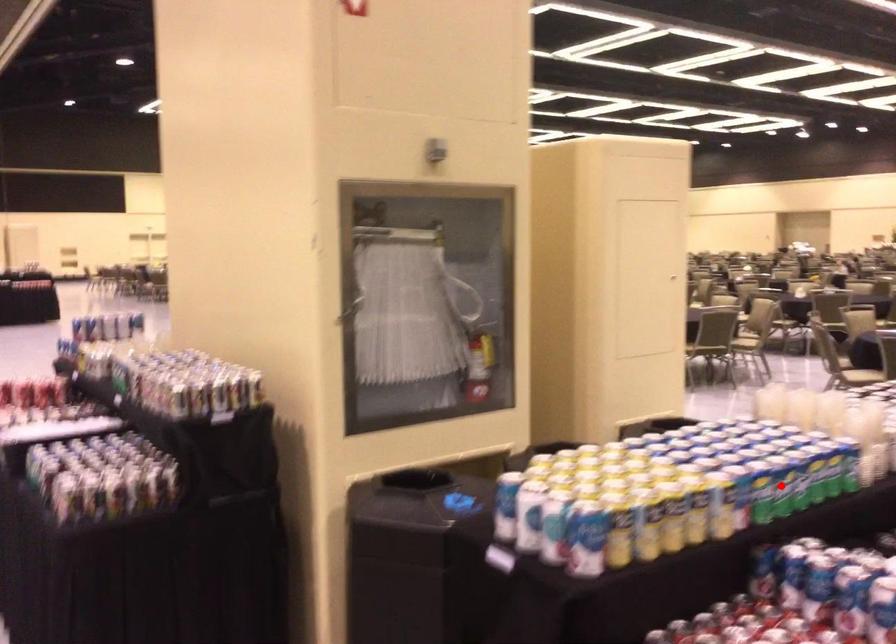
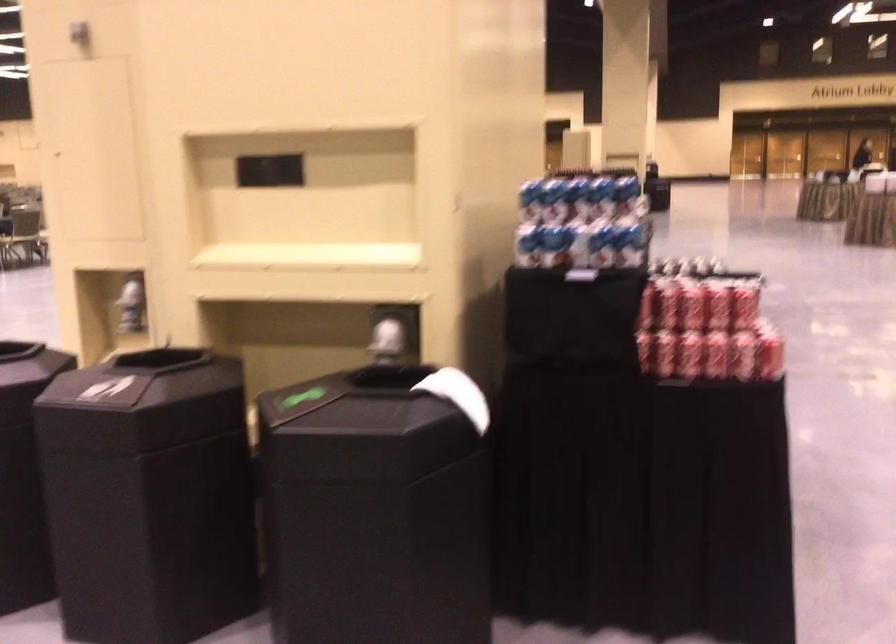
Question: I am providing you with two images of the same scene from different viewpoints. A red point is marked on the first image. At the location where the point appears in image 1, is it still visible in image 2?

Choices:
 (A) Yes
 (B) No

Answer: (B)